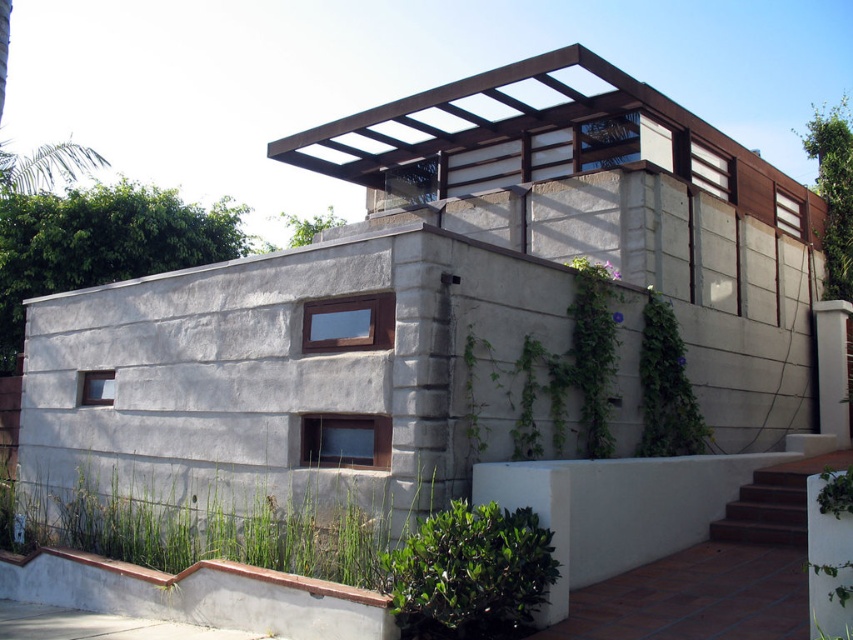
Does brown wood pergola at upper center have a greater height compared to green leafy plant at lower right?

Correct, brown wood pergola at upper center is much taller as green leafy plant at lower right.

Does brown wood pergola at upper center lie in front of green leafy plant at lower right?

No, it is behind green leafy plant at lower right.

Is point (756, 152) less distant than point (827, 509)?

No, (756, 152) is behind (827, 509).

The width and height of the screenshot is (853, 640). Find the location of `brown wood pergola at upper center`. brown wood pergola at upper center is located at coordinates (541, 140).

Does green leafy ivy at center appear on the left side of green leafy vine at upper right?

Yes, green leafy ivy at center is to the left of green leafy vine at upper right.

Does point (581, 353) come behind point (593, 273)?

No, (581, 353) is in front of (593, 273).

Where is `green leafy ivy at center`? green leafy ivy at center is located at coordinates (573, 371).

At what (x,y) coordinates should I click in order to perform the action: click on green leafy ivy at center. Please return your answer as a coordinate pair (x, y). Looking at the image, I should click on click(x=573, y=371).

The height and width of the screenshot is (640, 853). Describe the element at coordinates (527, 401) in the screenshot. I see `green leafy plant at center` at that location.

Is the position of green leafy plant at center more distant than that of green leafy plant at lower right?

Yes, green leafy plant at center is behind green leafy plant at lower right.

The width and height of the screenshot is (853, 640). Find the location of `green leafy plant at center`. green leafy plant at center is located at coordinates (527, 401).